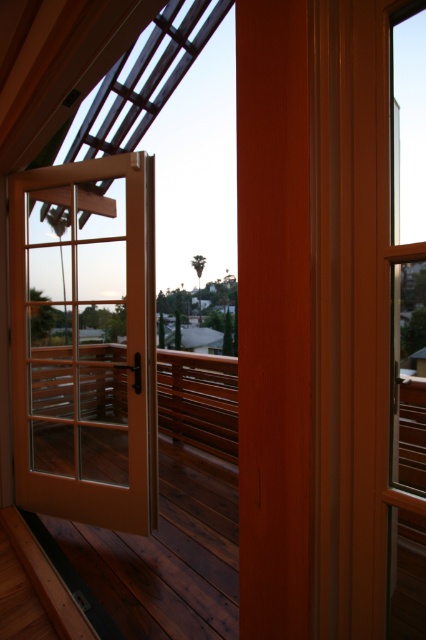
Question: Is dark brown wood at center to the left of clear glass door at center from the viewer's perspective?

Choices:
 (A) yes
 (B) no

Answer: (A)

Question: Estimate the real-world distances between objects in this image. Which object is closer to the dark brown wood at center?

Choices:
 (A) matte glass door at center
 (B) clear glass door at center

Answer: (B)

Question: Does matte glass door at center appear on the right side of dark brown wood at center?

Choices:
 (A) no
 (B) yes

Answer: (A)

Question: Considering the real-world distances, which object is closest to the clear glass door at center?

Choices:
 (A) matte glass door at center
 (B) dark brown wood at center

Answer: (B)

Question: Which point appears farthest from the camera in this image?

Choices:
 (A) (235, 461)
 (B) (210, 557)

Answer: (A)

Question: Observing the image, what is the correct spatial positioning of dark brown wood at center in reference to clear glass door at center?

Choices:
 (A) below
 (B) above

Answer: (A)